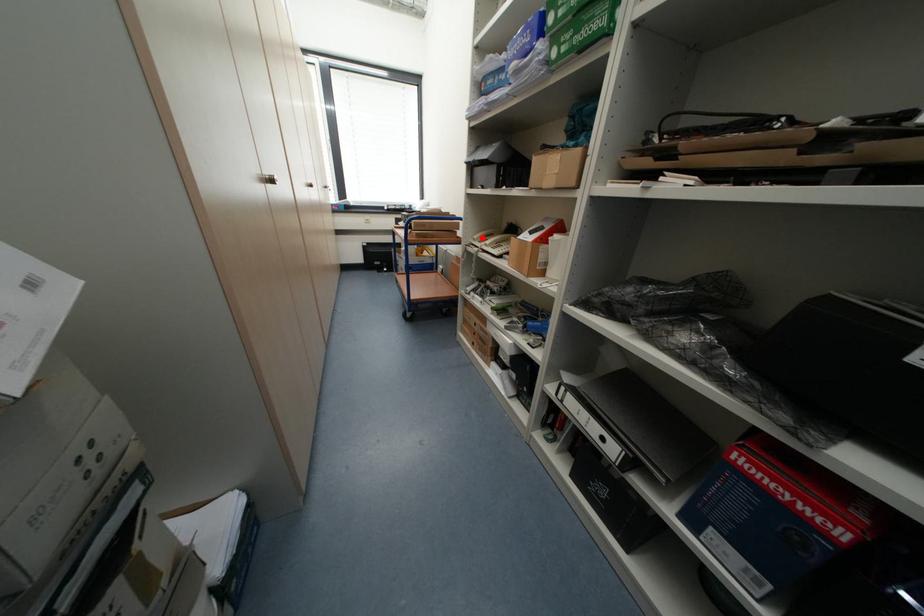
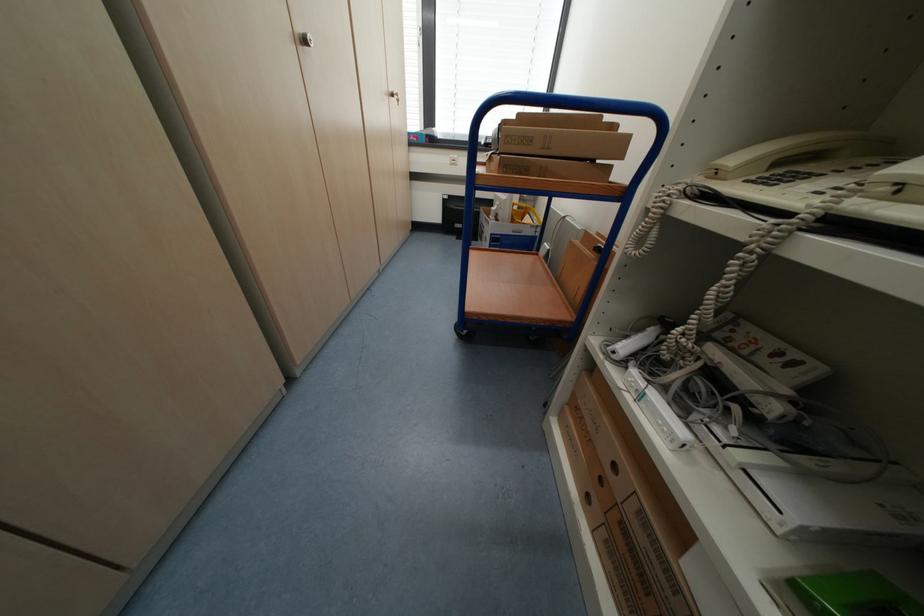
Find the pixel in the second image that matches the highlighted location in the first image.

(739, 161)